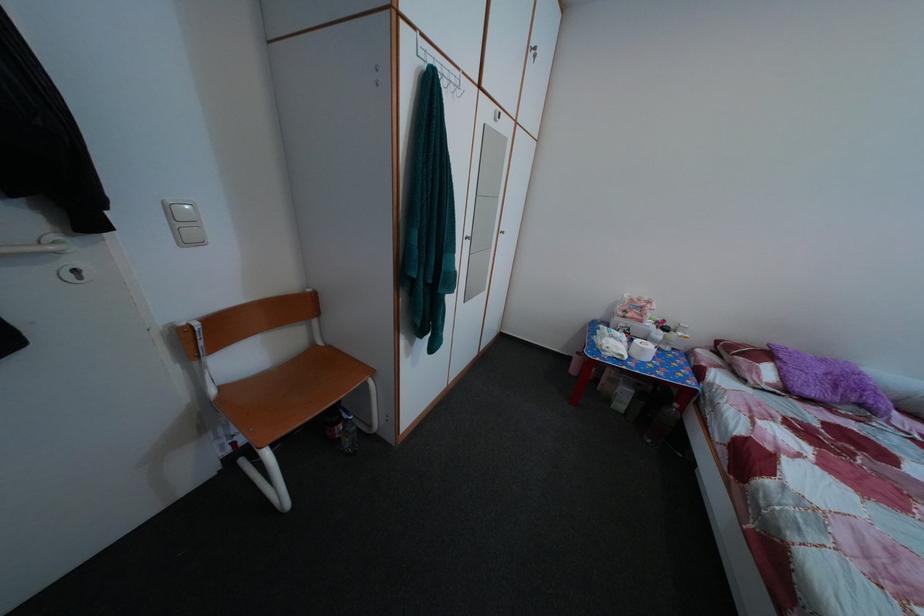
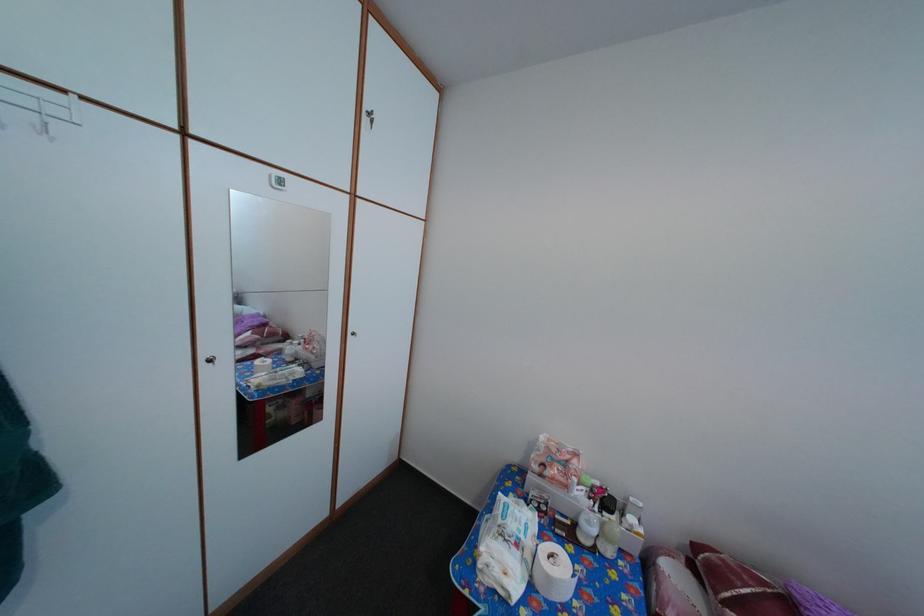
Where in the second image is the point corresponding to pixel 608 358 from the first image?

(484, 572)